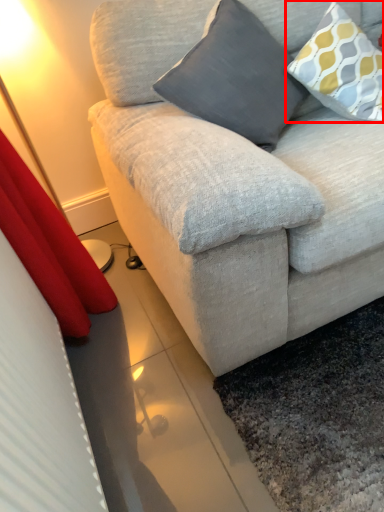
Question: From the image, what is the correct spatial relationship of pillow (annotated by the red box) in relation to pillow?

Choices:
 (A) left
 (B) right

Answer: (B)